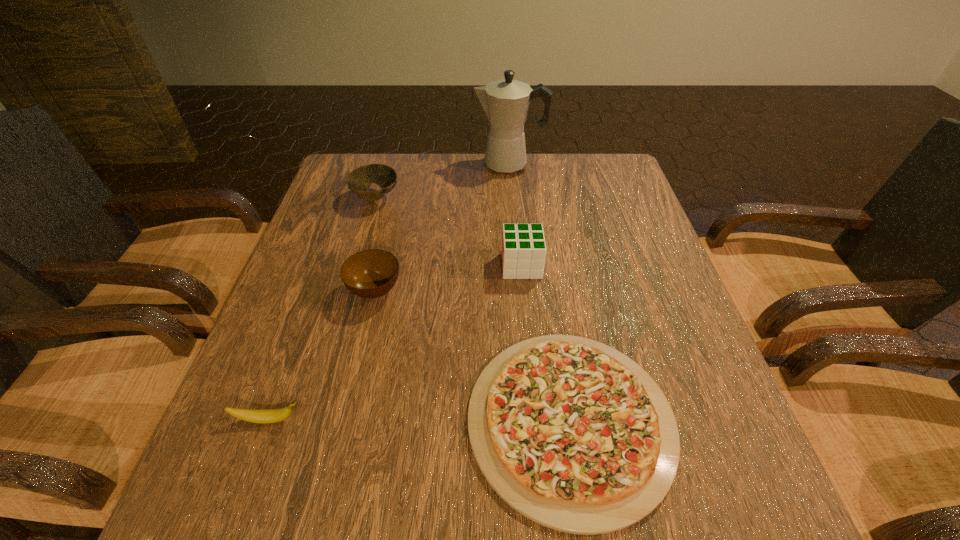
What are the coordinates of `the tallest object` in the screenshot? It's located at (506, 102).

You are a GUI agent. You are given a task and a screenshot of the screen. Output one action in this format:
    pyautogui.click(x=<x>, y=<y>)
    Task: Click on the farthest object
    Image resolution: width=960 pixels, height=540 pixels.
    Given the screenshot: What is the action you would take?
    pyautogui.click(x=506, y=102)

The image size is (960, 540). I want to click on the fifth shortest object, so tap(523, 252).

The height and width of the screenshot is (540, 960). What are the coordinates of `the fifth nearest object` in the screenshot? It's located at (359, 181).

Locate an element on the screen. the nearer bowl is located at coordinates (372, 273).

This screenshot has height=540, width=960. I want to click on the fifth tallest object, so click(275, 415).

Locate an element on the screen. pizza is located at coordinates (574, 435).

The height and width of the screenshot is (540, 960). I want to click on free space located on the left of the coffeepot, so click(x=419, y=164).

Find the location of a particular element. This screenshot has width=960, height=540. free space located on the red face of the second tallest object is located at coordinates (348, 266).

Image resolution: width=960 pixels, height=540 pixels. I want to click on free space located on the red face of the second tallest object, so (x=348, y=266).